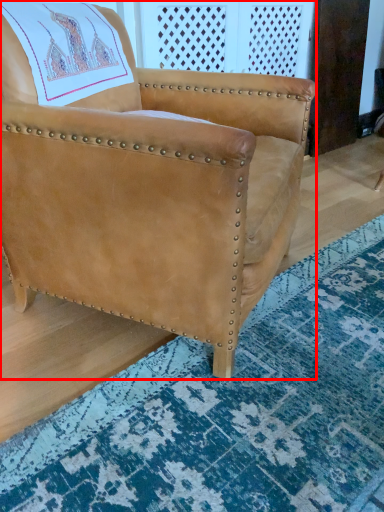
Question: From the image's perspective, where is chair (annotated by the red box) located relative to mat?

Choices:
 (A) above
 (B) below

Answer: (A)